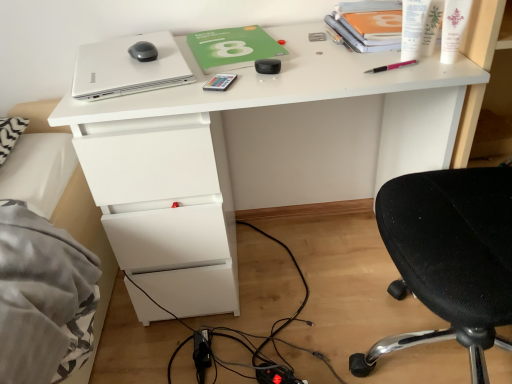
Question: Considering the relative sizes of white plastic pen at upper right, the 2th stationery from the right, and silver metallic laptop at upper left in the image provided, is white plastic pen at upper right, the 2th stationery from the right, wider than silver metallic laptop at upper left?

Choices:
 (A) no
 (B) yes

Answer: (A)

Question: Is white plastic pen at upper right, the 3th stationery when ordered from left to right, to the left of silver metallic laptop at upper left from the viewer's perspective?

Choices:
 (A) no
 (B) yes

Answer: (A)

Question: Is silver metallic laptop at upper left inside white plastic pen at upper right, the 3th stationery when ordered from left to right?

Choices:
 (A) yes
 (B) no

Answer: (B)

Question: Is white plastic pen at upper right, the 2th stationery from the right, further to the viewer compared to silver metallic laptop at upper left?

Choices:
 (A) yes
 (B) no

Answer: (B)

Question: Does white plastic pen at upper right, the 3th stationery when ordered from left to right, have a greater height compared to silver metallic laptop at upper left?

Choices:
 (A) yes
 (B) no

Answer: (A)

Question: Is matte black mouse at upper left in front of or behind green matte notebook at center in the image?

Choices:
 (A) behind
 (B) front

Answer: (A)

Question: Which is correct: matte black mouse at upper left is inside green matte notebook at center, or outside of it?

Choices:
 (A) outside
 (B) inside

Answer: (A)

Question: Considering the positions of point (146, 41) and point (196, 44), is point (146, 41) closer or farther from the camera than point (196, 44)?

Choices:
 (A) farther
 (B) closer

Answer: (B)

Question: From the image's perspective, is matte black mouse at upper left located above or below green matte notebook at center?

Choices:
 (A) below
 (B) above

Answer: (A)

Question: In the image, is white glossy cream at upper right positioned in front of or behind metallic rectangular object at center, the 1th stationery in the left-to-right sequence?

Choices:
 (A) front
 (B) behind

Answer: (A)

Question: Choose the correct answer: Is white glossy cream at upper right inside metallic rectangular object at center, which is the fourth stationery in right-to-left order, or outside it?

Choices:
 (A) inside
 (B) outside

Answer: (B)

Question: Considering the positions of point (450, 11) and point (224, 86), is point (450, 11) closer or farther from the camera than point (224, 86)?

Choices:
 (A) farther
 (B) closer

Answer: (B)

Question: In terms of width, does white glossy cream at upper right look wider or thinner when compared to metallic rectangular object at center, which is the fourth stationery in right-to-left order?

Choices:
 (A) wide
 (B) thin

Answer: (B)

Question: From their relative heights in the image, would you say white glossy cream at upper right is taller or shorter than green matte notebook at center?

Choices:
 (A) short
 (B) tall

Answer: (B)

Question: Based on their positions, is white glossy cream at upper right located to the left or right of green matte notebook at center?

Choices:
 (A) left
 (B) right

Answer: (B)